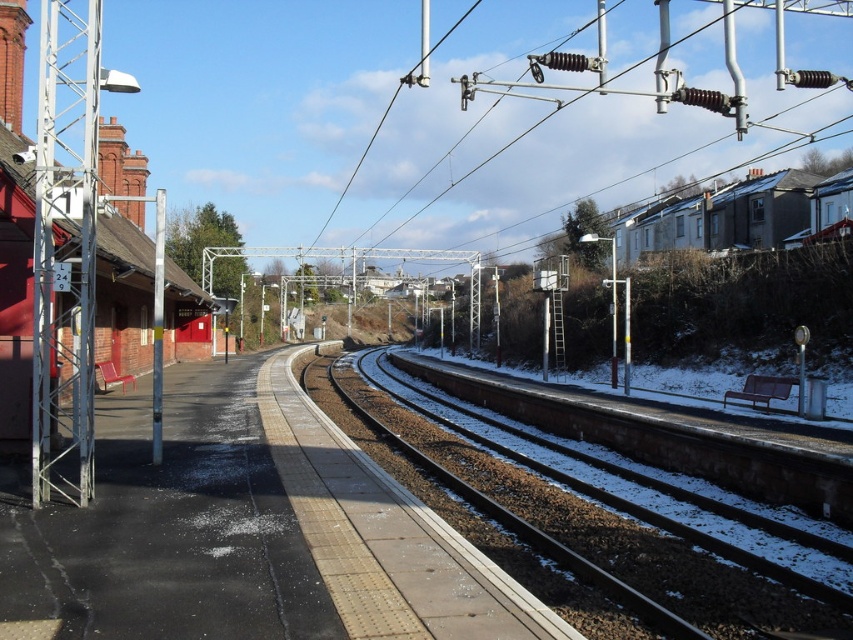
Question: Can you confirm if brown gravel track at center is bigger than white matte houses at upper right?

Choices:
 (A) no
 (B) yes

Answer: (A)

Question: Does brown gravel track at center have a greater width compared to white matte houses at upper right?

Choices:
 (A) yes
 (B) no

Answer: (B)

Question: Which object appears closest to the camera in this image?

Choices:
 (A) white matte houses at upper right
 (B) brown gravel track at center

Answer: (B)

Question: Which point is closer to the camera?

Choices:
 (A) white matte houses at upper right
 (B) brown gravel track at center

Answer: (B)

Question: Does brown gravel track at center appear on the right side of white matte houses at upper right?

Choices:
 (A) no
 (B) yes

Answer: (A)